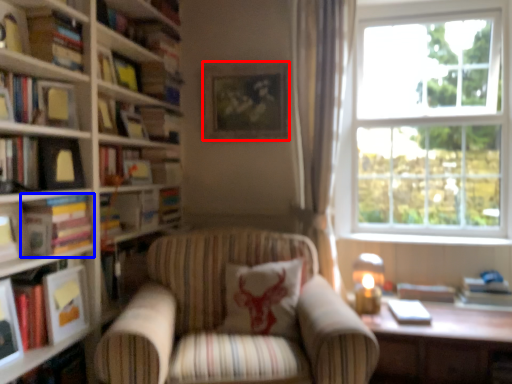
Question: Which of the following is the farthest to the observer, picture frame (highlighted by a red box) or book (highlighted by a blue box)?

Choices:
 (A) picture frame
 (B) book

Answer: (A)